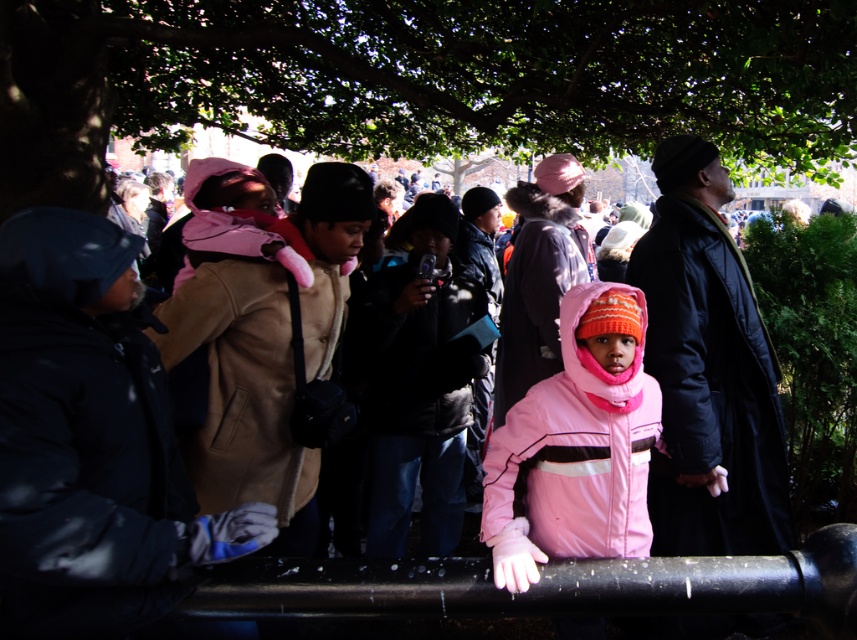
Looking at this image, between green leafy tree at upper center and dark brown leather jacket at center, which one appears on the left side from the viewer's perspective?

green leafy tree at upper center is more to the left.

What do you see at coordinates (418, 80) in the screenshot? I see `green leafy tree at upper center` at bounding box center [418, 80].

Image resolution: width=857 pixels, height=640 pixels. What are the coordinates of `green leafy tree at upper center` in the screenshot? It's located at (418, 80).

Locate an element on the screen. The width and height of the screenshot is (857, 640). green leafy tree at upper center is located at coordinates (418, 80).

Describe the element at coordinates (240, 387) in the screenshot. The image size is (857, 640). I see `tan leather jacket at center` at that location.

I want to click on tan leather jacket at center, so click(240, 387).

Is pink fleece jacket at center in front of matte pink coat at center?

That is True.

Can you confirm if pink fleece jacket at center is positioned below matte pink coat at center?

Yes.

Does point (703, 500) come in front of point (550, 266)?

Yes.

Identify the location of pink fleece jacket at center. (710, 392).